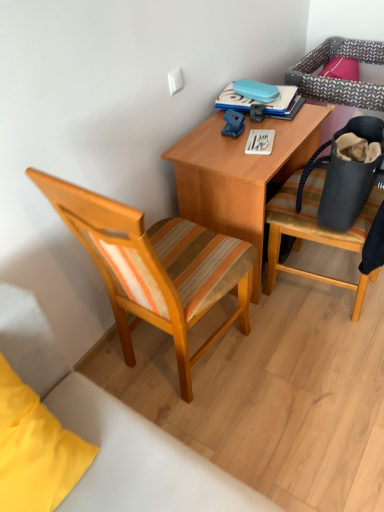
Locate an element on the screen. vacant area situated below wooden striped cushioned chair at right, the 2th chair viewed from the left (from a real-world perspective) is located at coordinates (332, 290).